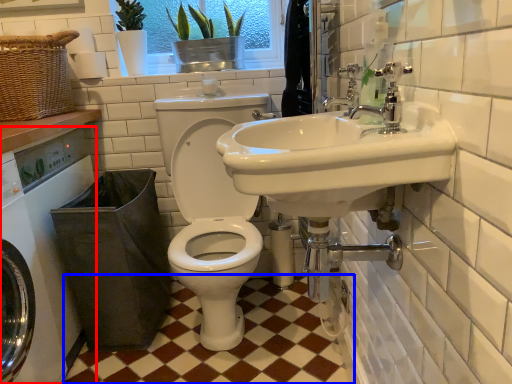
Question: Among these objects, which one is nearest to the camera, washing machine (highlighted by a red box) or ceramic tile (highlighted by a blue box)?

Choices:
 (A) washing machine
 (B) ceramic tile

Answer: (A)